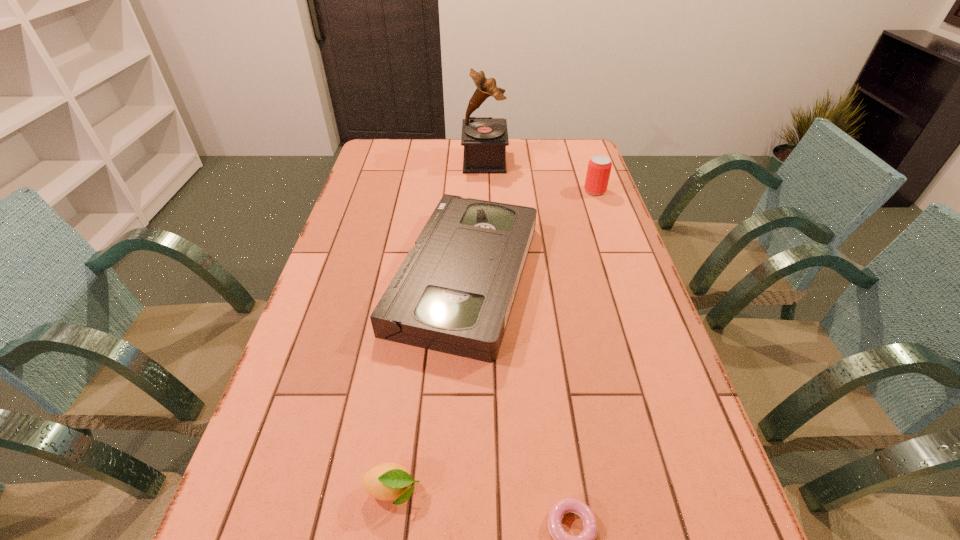
I want to click on vacant space situated on the back of the third farthest object, so click(468, 185).

At what (x,y) coordinates should I click in order to perform the action: click on free space located 0.250m with leaves positioned above the lemon. Please return your answer as a coordinate pair (x, y). Looking at the image, I should click on (559, 491).

This screenshot has height=540, width=960. What are the coordinates of `object that is at the far edge` in the screenshot? It's located at (484, 139).

The image size is (960, 540). I want to click on object that is at the right edge, so click(599, 167).

Identify the location of free space at the left edge. Image resolution: width=960 pixels, height=540 pixels. (303, 389).

This screenshot has height=540, width=960. I want to click on free space at the right edge of the desktop, so click(x=576, y=256).

Locate an element on the screen. free space between the lemon and the third nearest object is located at coordinates (429, 383).

You are a GUI agent. You are given a task and a screenshot of the screen. Output one action in this format:
    pyautogui.click(x=<x>, y=<y>)
    Task: Click on the free spot between the farthest object and the rightmost object
    This screenshot has width=960, height=540.
    Given the screenshot: What is the action you would take?
    pyautogui.click(x=540, y=176)

You are a GUI agent. You are given a task and a screenshot of the screen. Output one action in this format:
    pyautogui.click(x=<x>, y=<y>)
    Task: Click on the free space between the lemon and the third nearest object
    The width and height of the screenshot is (960, 540).
    Given the screenshot: What is the action you would take?
    pyautogui.click(x=429, y=383)

The image size is (960, 540). Find the location of `the second closest object relative to the second tallest object`. the second closest object relative to the second tallest object is located at coordinates (484, 139).